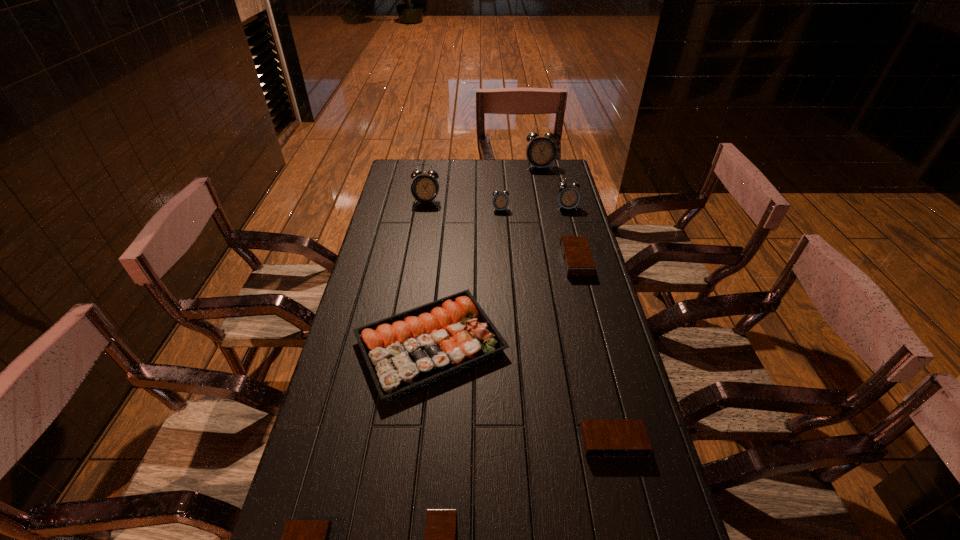
Identify which alarm clock is the nearest to the second farthest black alarm clock. Please provide its 2D coordinates. Your answer should be formatted as a tuple, i.e. [(x, y)], where the tuple contains the x and y coordinates of a point satisfying the conditions above.

[(440, 532)]

Locate an element on the screen. The height and width of the screenshot is (540, 960). white alarm clock that stands as the third closest to the leftmost white alarm clock is located at coordinates (568, 197).

Locate an element on the screen. white alarm clock object that ranks as the second closest to the fourth shortest alarm clock is located at coordinates (500, 201).

You are a GUI agent. You are given a task and a screenshot of the screen. Output one action in this format:
    pyautogui.click(x=<x>, y=<y>)
    Task: Click on the black alarm clock that stands as the closest to the farthest object
    The image size is (960, 540).
    Given the screenshot: What is the action you would take?
    pos(578,262)

Locate which black alarm clock is the second closest to the fourth shortest alarm clock. Please provide its 2D coordinates. Your answer should be formatted as a tuple, i.e. [(x, y)], where the tuple contains the x and y coordinates of a point satisfying the conditions above.

[(440, 532)]